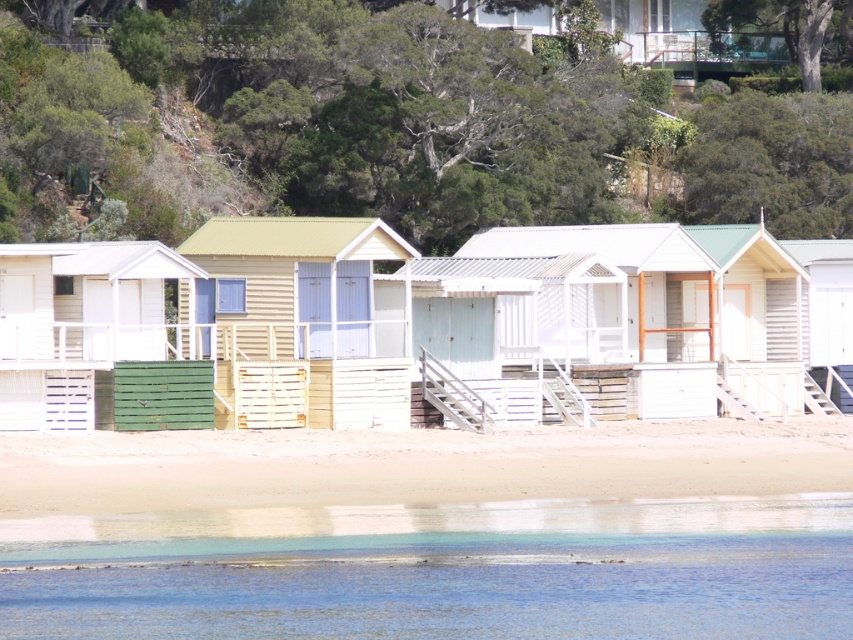
Question: Which point is closer to the camera taking this photo?

Choices:
 (A) (32, 419)
 (B) (117, 529)

Answer: (B)

Question: Which point appears farthest from the camera in this image?

Choices:
 (A) (1, 472)
 (B) (55, 252)
 (C) (837, 499)
 (D) (360, 397)

Answer: (D)

Question: Which is nearer to the beige sand at lower center?

Choices:
 (A) clear water at lower center
 (B) wooden beach hut at center
 (C) matte green wood beach hut at left

Answer: (C)

Question: Does clear water at lower center appear on the left side of wooden beach hut at center?

Choices:
 (A) yes
 (B) no

Answer: (B)

Question: Does clear water at lower center have a greater width compared to wooden beach hut at center?

Choices:
 (A) yes
 (B) no

Answer: (A)

Question: Is clear water at lower center thinner than beige sand at lower center?

Choices:
 (A) no
 (B) yes

Answer: (B)